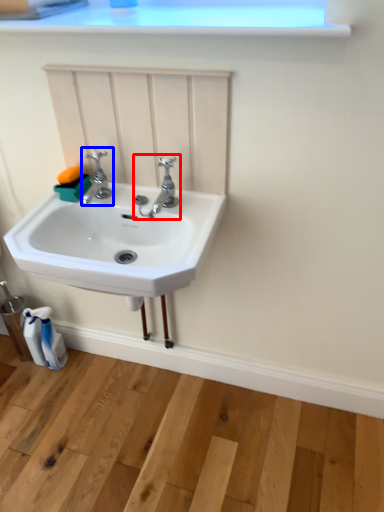
Question: Which of the following is the closest to the observer, tap (highlighted by a red box) or tap (highlighted by a blue box)?

Choices:
 (A) tap
 (B) tap

Answer: (A)